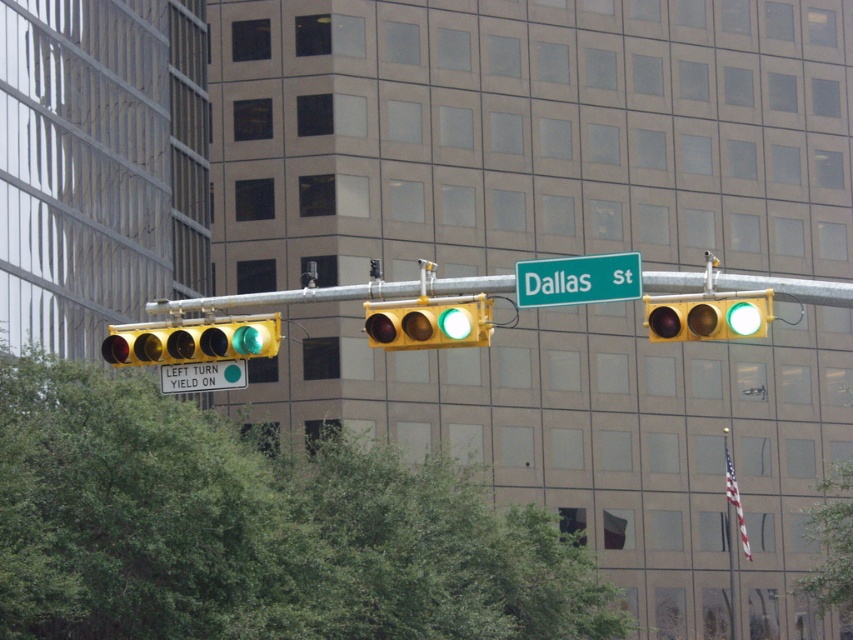
You are a pedestrian standing at the crosswalk and see the yellow matte traffic light at left and the yellow matte traffic light at center. Which one is closer to you?

The yellow matte traffic light at left is closer to you because the yellow matte traffic light at center is behind it.

You are a pedestrian standing at the intersection and want to cross the street. There is a green leafy tree at center and a green metallic street sign at upper center. Which object is bigger in the scene?

The green leafy tree at center is larger in size compared to the green metallic street sign at upper center.